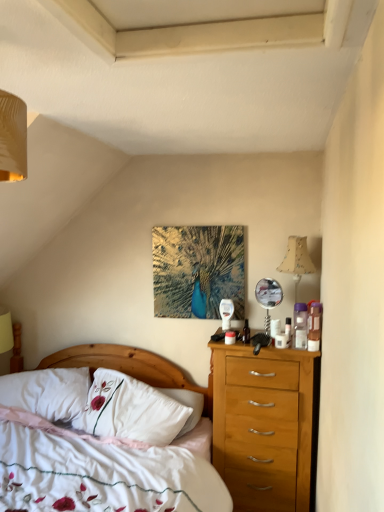
What do you see at coordinates (297, 260) in the screenshot? The image size is (384, 512). I see `beige fabric lampshade at right` at bounding box center [297, 260].

Identify the location of metallic peacock art at center. This screenshot has width=384, height=512. (198, 270).

The width and height of the screenshot is (384, 512). Identify the location of white soft pillow at lower left, the second pillow viewed from the right. (48, 393).

Is metallic peacock art at center at the back of beige fabric lampshade at right?

No, beige fabric lampshade at right's orientation is not away from metallic peacock art at center.

Are beige fabric lampshade at right and metallic peacock art at center making contact?

beige fabric lampshade at right and metallic peacock art at center are not in contact.

Is point (302, 264) behind point (187, 289)?

No, it is not.

This screenshot has height=512, width=384. I want to click on lamp that appears below the metallic peacock art at center (from the image's perspective), so click(x=297, y=260).

Is white soft pillow at lower left, the second pillow viewed from the right, aimed at white cotton bed at center?

Yes.

Which is behind, point (19, 395) or point (137, 467)?

The point (19, 395) is farther from the camera.

Is the position of white soft pillow at lower left, the second pillow viewed from the right, more distant than that of white cotton bed at center?

Yes, the depth of white soft pillow at lower left, the second pillow viewed from the right, is greater than that of white cotton bed at center.

From a real-world perspective, who is located higher, white soft pillow at lower left, which is the first pillow in left-to-right order, or white cotton bed at center?

white soft pillow at lower left, which is the first pillow in left-to-right order.

From the image's perspective, would you say white soft pillow at lower left, which is the first pillow in left-to-right order, is shown under metallic peacock art at center?

Indeed, from the image's perspective, white soft pillow at lower left, which is the first pillow in left-to-right order, is shown beneath metallic peacock art at center.

Could you tell me if white soft pillow at lower left, the second pillow viewed from the right, is turned towards metallic peacock art at center?

No, white soft pillow at lower left, the second pillow viewed from the right, is not aimed at metallic peacock art at center.

Based on their sizes in the image, would you say white soft pillow at lower left, which is the first pillow in left-to-right order, is bigger or smaller than metallic peacock art at center?

white soft pillow at lower left, which is the first pillow in left-to-right order, is bigger than metallic peacock art at center.

From the picture: Is white soft pillow at lower left, the second pillow viewed from the right, wider than metallic peacock art at center?

Indeed, white soft pillow at lower left, the second pillow viewed from the right, has a greater width compared to metallic peacock art at center.

Considering the sizes of objects metallic peacock art at center and white cotton bed at center in the image provided, who is thinner, metallic peacock art at center or white cotton bed at center?

Thinner between the two is metallic peacock art at center.

Is metallic peacock art at center directly adjacent to white cotton bed at center?

No, metallic peacock art at center is not with white cotton bed at center.

Which of these two, metallic peacock art at center or white cotton bed at center, stands taller?

With more height is white cotton bed at center.

Considering the relative positions of metallic peacock art at center and white cotton bed at center in the image provided, is metallic peacock art at center to the right of white cotton bed at center from the viewer's perspective?

Correct, you'll find metallic peacock art at center to the right of white cotton bed at center.

Looking at this image, would you consider white cotton bed at center to be distant from beige fabric lampshade at right?

That's right, there is a large distance between white cotton bed at center and beige fabric lampshade at right.

Between white cotton bed at center and beige fabric lampshade at right, which one has larger width?

With larger width is white cotton bed at center.

Do you think white cotton bed at center is within beige fabric lampshade at right, or outside of it?

white cotton bed at center exists outside the volume of beige fabric lampshade at right.

From a real-world perspective, who is located lower, white cotton bed at center or beige fabric lampshade at right?

white cotton bed at center, from a real-world perspective.

Does beige fabric lampshade at right have a smaller size compared to white soft pillow at lower left, which is the first pillow in left-to-right order?

Yes.

Which is further, (307,268) or (50,376)?

The point (50,376) is farther.

Between beige fabric lampshade at right and white soft pillow at lower left, the second pillow viewed from the right, which one has less height?

white soft pillow at lower left, the second pillow viewed from the right.

Is beige fabric lampshade at right looking in the opposite direction of white soft pillow at lower left, which is the first pillow in left-to-right order?

That's not correct — beige fabric lampshade at right is not looking away from white soft pillow at lower left, which is the first pillow in left-to-right order.

Does point (161, 424) come closer to viewer compared to point (305, 245)?

Yes.

Based on the photo, is beige fabric lampshade at right at the back of white embroidered pillow at center, the first pillow viewed from the right?

No, white embroidered pillow at center, the first pillow viewed from the right,'s orientation is not away from beige fabric lampshade at right.

Are white embroidered pillow at center, the first pillow viewed from the right, and beige fabric lampshade at right making contact?

There is a gap between white embroidered pillow at center, the first pillow viewed from the right, and beige fabric lampshade at right.

In the image, there is a white embroidered pillow at center, the first pillow viewed from the right. Where is `lamp above it (from the image's perspective)`? The image size is (384, 512). lamp above it (from the image's perspective) is located at coordinates (297, 260).

This screenshot has width=384, height=512. In order to click on picture frame behind the beige fabric lampshade at right in this screenshot , I will do `click(198, 270)`.

There is a white cotton bed at center. At what (x,y) coordinates should I click in order to perform the action: click on the 1st pillow above it (from a real-world perspective). Please return your answer as a coordinate pair (x, y). The image size is (384, 512). Looking at the image, I should click on (48, 393).

Looking at the image, which one is located closer to metallic peacock art at center, white soft pillow at lower left, the second pillow viewed from the right, or white cotton bed at center?

The object closer to metallic peacock art at center is white cotton bed at center.

Estimate the real-world distances between objects in this image. Which object is closer to beige fabric lampshade at right, metallic peacock art at center or white embroidered pillow at center, acting as the second pillow starting from the left?

metallic peacock art at center is closer to beige fabric lampshade at right.

Looking at the image, which one is located further to white cotton bed at center, white soft pillow at lower left, the second pillow viewed from the right, or metallic peacock art at center?

Based on the image, metallic peacock art at center appears to be further to white cotton bed at center.

From the image, which object appears to be farther from white embroidered pillow at center, acting as the second pillow starting from the left, white soft pillow at lower left, which is the first pillow in left-to-right order, or metallic peacock art at center?

metallic peacock art at center.

Estimate the real-world distances between objects in this image. Which object is further from beige fabric lampshade at right, metallic peacock art at center or white soft pillow at lower left, the second pillow viewed from the right?

white soft pillow at lower left, the second pillow viewed from the right, is further to beige fabric lampshade at right.

Considering their positions, is metallic peacock art at center positioned closer to white cotton bed at center than beige fabric lampshade at right?

metallic peacock art at center lies closer to white cotton bed at center than the other object.

Which object lies nearer to the anchor point white cotton bed at center, white embroidered pillow at center, acting as the second pillow starting from the left, or white soft pillow at lower left, which is the first pillow in left-to-right order?

white soft pillow at lower left, which is the first pillow in left-to-right order, is closer to white cotton bed at center.

Estimate the real-world distances between objects in this image. Which object is further from white soft pillow at lower left, which is the first pillow in left-to-right order, beige fabric lampshade at right or white cotton bed at center?

beige fabric lampshade at right is positioned further to the anchor white soft pillow at lower left, which is the first pillow in left-to-right order.

Where is `picture frame located between white soft pillow at lower left, which is the first pillow in left-to-right order, and beige fabric lampshade at right in the left-right direction`? The height and width of the screenshot is (512, 384). picture frame located between white soft pillow at lower left, which is the first pillow in left-to-right order, and beige fabric lampshade at right in the left-right direction is located at coordinates (198, 270).

Where is `pillow located between white soft pillow at lower left, the second pillow viewed from the right, and metallic peacock art at center in the left-right direction`? The height and width of the screenshot is (512, 384). pillow located between white soft pillow at lower left, the second pillow viewed from the right, and metallic peacock art at center in the left-right direction is located at coordinates (134, 410).

Identify the location of pillow between white cotton bed at center and white soft pillow at lower left, the second pillow viewed from the right, along the z-axis. The width and height of the screenshot is (384, 512). (134, 410).

You are a GUI agent. You are given a task and a screenshot of the screen. Output one action in this format:
    pyautogui.click(x=<x>, y=<y>)
    Task: Click on the lamp between white cotton bed at center and white soft pillow at lower left, the second pillow viewed from the right, along the z-axis
    
    Given the screenshot: What is the action you would take?
    pyautogui.click(x=297, y=260)